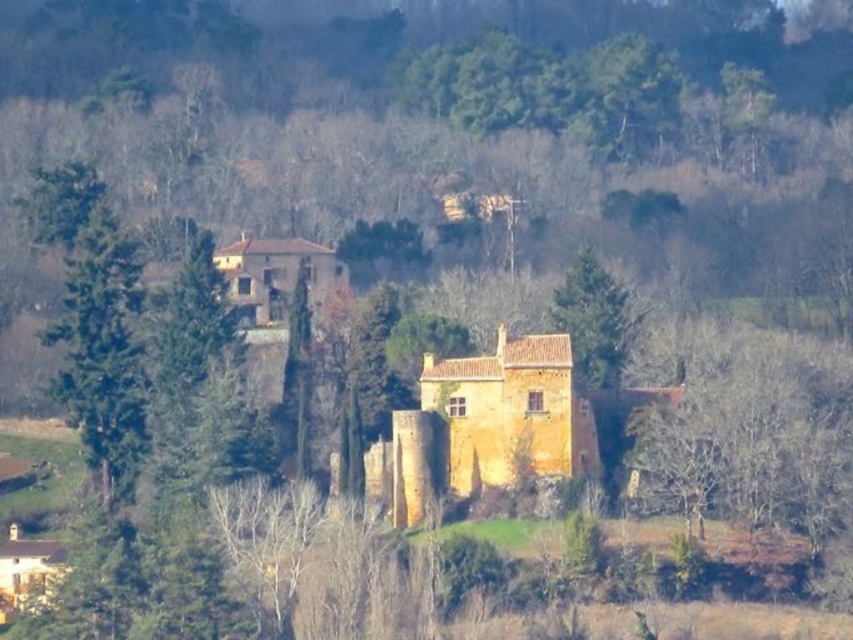
Question: Can you confirm if green rough bark tree at left is positioned below green textured tree at center?

Choices:
 (A) no
 (B) yes

Answer: (A)

Question: Which of the following is the closest to the observer?

Choices:
 (A) green rough bark tree at left
 (B) yellow stone castle at center
 (C) green textured tree at center

Answer: (B)

Question: Which of these objects is positioned closest to the green rough bark tree at left?

Choices:
 (A) yellow stone castle at center
 (B) green textured tree at center

Answer: (A)

Question: Which object appears farthest from the camera in this image?

Choices:
 (A) yellow stone castle at center
 (B) green textured tree at center
 (C) green rough bark tree at left

Answer: (C)

Question: Can you confirm if green rough bark tree at left is bigger than green textured tree at center?

Choices:
 (A) yes
 (B) no

Answer: (A)

Question: Can you confirm if yellow stone castle at center is positioned above green textured tree at center?

Choices:
 (A) no
 (B) yes

Answer: (A)